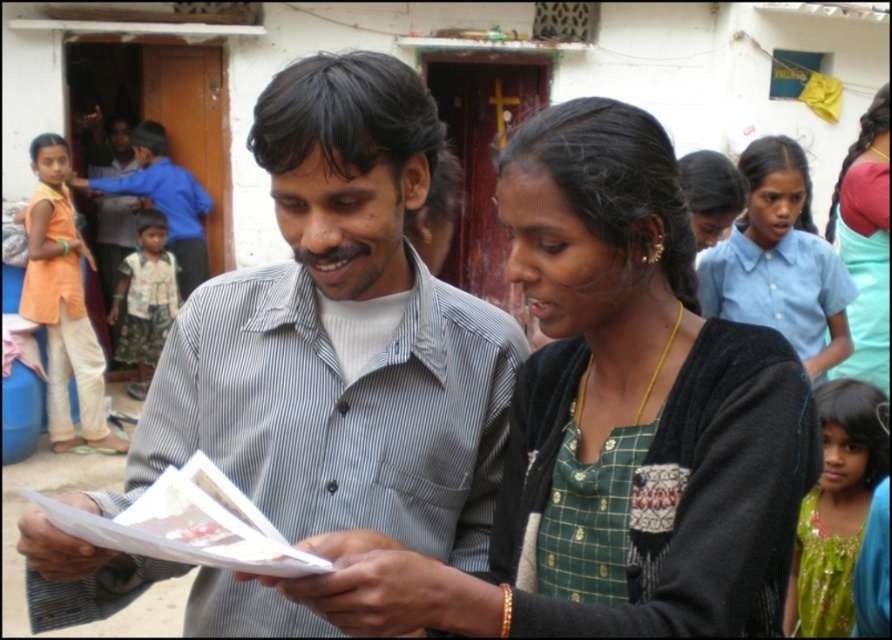
Is striped cotton shirt at center above green embroidered dress at lower right?

Indeed, striped cotton shirt at center is positioned over green embroidered dress at lower right.

Is striped cotton shirt at center bigger than green embroidered dress at lower right?

Yes.

Who is more forward, [22,536] or [822,428]?

Positioned in front is point [22,536].

This screenshot has height=640, width=892. What are the coordinates of `striped cotton shirt at center` in the screenshot? It's located at (340, 336).

Is the position of printed cotton shirt at left more distant than that of green woven apron at lower right?

Yes.

Is point (147, 257) positioned behind point (841, 566)?

Yes, it is.

Is point (154, 273) more distant than point (827, 577)?

Yes, it is.

The image size is (892, 640). Identify the location of printed cotton shirt at left. (145, 300).

Between point (808, 333) and point (805, 580), which one is positioned in front?

Point (805, 580) is in front.

Does point (816, 314) lie behind point (833, 536)?

That is True.

Does point (752, 220) come closer to viewer compared to point (804, 506)?

No, it is not.

You are a GUI agent. You are given a task and a screenshot of the screen. Output one action in this format:
    pyautogui.click(x=<x>, y=<y>)
    Task: Click on the light blue uniform at upper right
    The height and width of the screenshot is (640, 892).
    Given the screenshot: What is the action you would take?
    pyautogui.click(x=779, y=260)